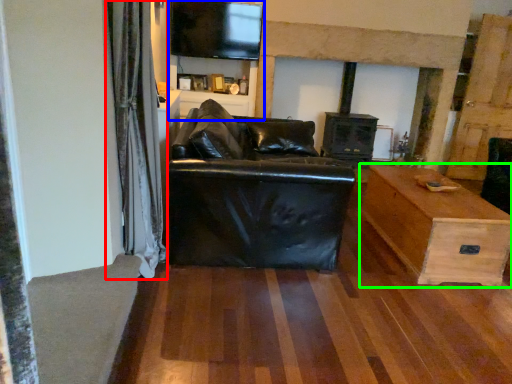
Question: Which object is the farthest from curtain (highlighted by a red box)? Choose among these: entertainment center (highlighted by a blue box) or table (highlighted by a green box).

Choices:
 (A) entertainment center
 (B) table

Answer: (A)